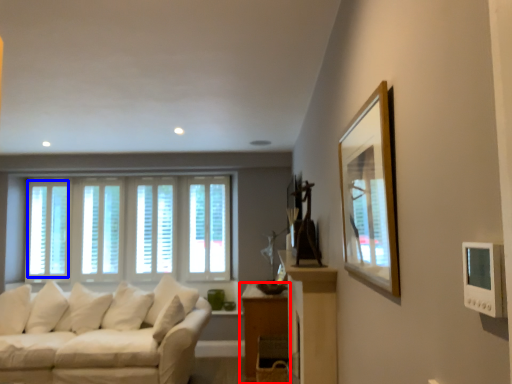
Question: Which of the following is the farthest to the observer, table (highlighted by a red box) or window (highlighted by a blue box)?

Choices:
 (A) table
 (B) window

Answer: (B)